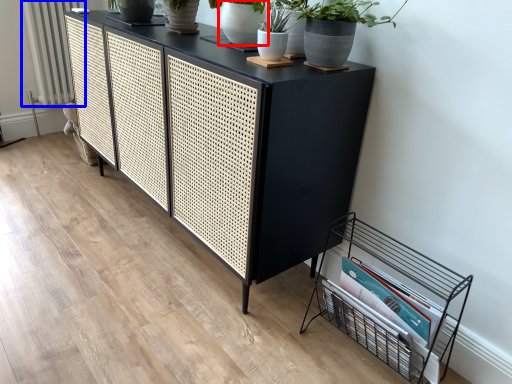
Question: Which object appears farthest to the camera in this image, flowerpot (highlighted by a red box) or radiator (highlighted by a blue box)?

Choices:
 (A) flowerpot
 (B) radiator

Answer: (B)